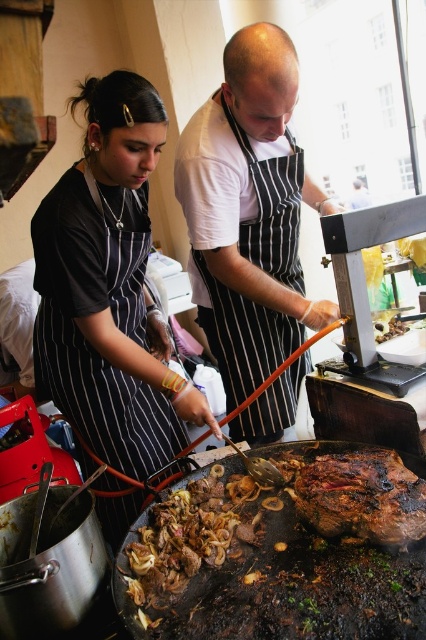
Question: Which object is closer to the camera taking this photo?

Choices:
 (A) white striped apron at center
 (B) brown crispy bread at center
 (C) brown crispy meat at center
 (D) black striped apron at left

Answer: (C)

Question: Can you confirm if brown crispy meat at center is thinner than black striped apron at left?

Choices:
 (A) no
 (B) yes

Answer: (A)

Question: Which of the following is the closest to the observer?

Choices:
 (A) brown crispy meat at center
 (B) brown crispy bread at center
 (C) black striped apron at left
 (D) white striped apron at center

Answer: (A)

Question: Which object is the farthest from the brown crispy meat at center?

Choices:
 (A) brown crispy bread at center
 (B) white striped apron at center
 (C) black striped apron at left
 (D) brown charred meat at center

Answer: (A)

Question: Is brown crispy meat at center smaller than brown charred meat at center?

Choices:
 (A) yes
 (B) no

Answer: (B)

Question: Does brown charred meat at center have a greater width compared to brown crispy bread at center?

Choices:
 (A) yes
 (B) no

Answer: (A)